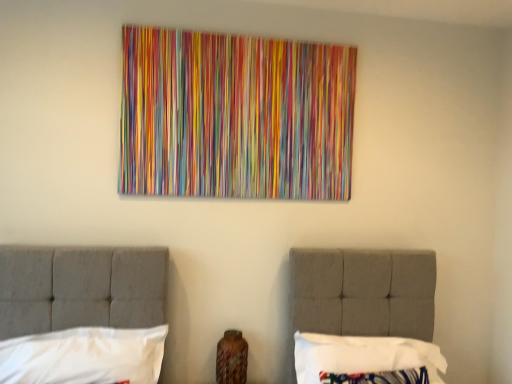
Question: Does white fabric pillow at lower right, placed as the second pillow when sorted from left to right, contain white fabric pillow at lower left, which is counted as the 2th pillow, starting from the right?

Choices:
 (A) no
 (B) yes

Answer: (A)

Question: Considering the relative sizes of white fabric pillow at lower right, placed as the second pillow when sorted from left to right, and white fabric pillow at lower left, placed as the 1th pillow when sorted from left to right, in the image provided, is white fabric pillow at lower right, placed as the second pillow when sorted from left to right, shorter than white fabric pillow at lower left, placed as the 1th pillow when sorted from left to right,?

Choices:
 (A) no
 (B) yes

Answer: (A)

Question: Is white fabric pillow at lower right, which is counted as the first pillow, starting from the right, thinner than white fabric pillow at lower left, placed as the 1th pillow when sorted from left to right?

Choices:
 (A) no
 (B) yes

Answer: (A)

Question: Is white fabric pillow at lower right, placed as the second pillow when sorted from left to right, closer to the viewer compared to white fabric pillow at lower left, which is counted as the 2th pillow, starting from the right?

Choices:
 (A) yes
 (B) no

Answer: (B)

Question: Is white fabric pillow at lower right, which is counted as the first pillow, starting from the right, to the right of white fabric pillow at lower left, placed as the 1th pillow when sorted from left to right, from the viewer's perspective?

Choices:
 (A) no
 (B) yes

Answer: (B)

Question: Can you confirm if white fabric pillow at lower right, which is counted as the first pillow, starting from the right, is taller than white fabric pillow at lower left, placed as the 1th pillow when sorted from left to right?

Choices:
 (A) no
 (B) yes

Answer: (B)

Question: Would you say white fabric pillow at lower left, placed as the 1th pillow when sorted from left to right, is outside white fabric pillow at lower right, placed as the second pillow when sorted from left to right?

Choices:
 (A) yes
 (B) no

Answer: (A)

Question: Can you confirm if white fabric pillow at lower left, placed as the 1th pillow when sorted from left to right, is thinner than white fabric pillow at lower right, which is counted as the first pillow, starting from the right?

Choices:
 (A) no
 (B) yes

Answer: (B)

Question: From a real-world perspective, is white fabric pillow at lower left, placed as the 1th pillow when sorted from left to right, over white fabric pillow at lower right, placed as the second pillow when sorted from left to right?

Choices:
 (A) yes
 (B) no

Answer: (A)

Question: From the image's perspective, is white fabric pillow at lower left, placed as the 1th pillow when sorted from left to right, over white fabric pillow at lower right, placed as the second pillow when sorted from left to right?

Choices:
 (A) no
 (B) yes

Answer: (B)

Question: Could white fabric pillow at lower right, which is counted as the first pillow, starting from the right, be considered to be inside white fabric pillow at lower left, placed as the 1th pillow when sorted from left to right?

Choices:
 (A) no
 (B) yes

Answer: (A)

Question: Is white fabric pillow at lower left, which is counted as the 2th pillow, starting from the right, further to the viewer compared to white fabric pillow at lower right, placed as the second pillow when sorted from left to right?

Choices:
 (A) no
 (B) yes

Answer: (A)

Question: Considering the positions of white fabric pillow at lower right, which is counted as the first pillow, starting from the right, and white fabric pillow at lower left, placed as the 1th pillow when sorted from left to right, in the image, is white fabric pillow at lower right, which is counted as the first pillow, starting from the right, wider or thinner than white fabric pillow at lower left, placed as the 1th pillow when sorted from left to right,?

Choices:
 (A) wide
 (B) thin

Answer: (A)